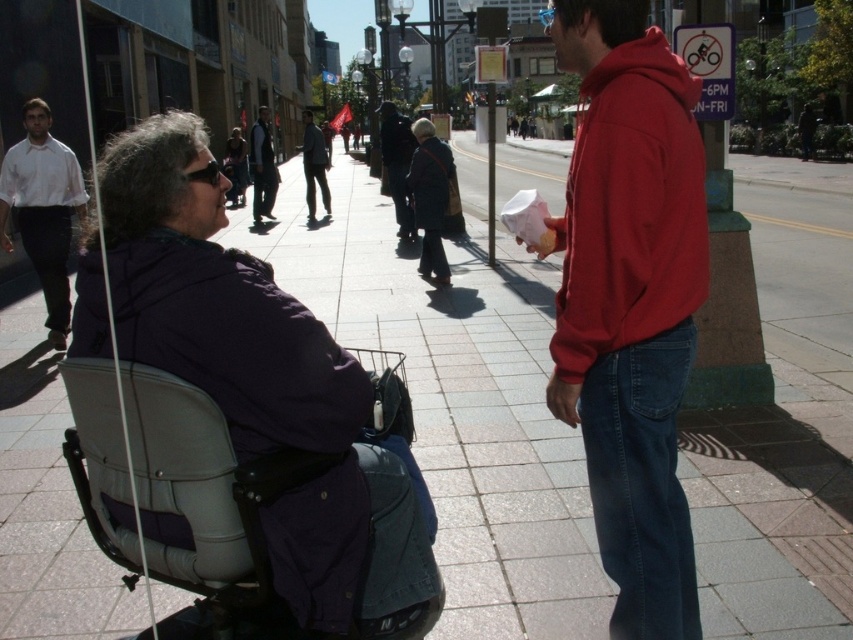
Question: Which of the following is the closest to the observer?

Choices:
 (A) (311, 113)
 (B) (422, 225)
 (C) (77, 173)
 (D) (405, 168)

Answer: (C)

Question: Which point is closer to the camera?

Choices:
 (A) purple soft fabric wheelchair at left
 (B) dark blue jacket at center

Answer: (A)

Question: Which object appears farthest from the camera in this image?

Choices:
 (A) red cotton hoodie at right
 (B) white shirt at left
 (C) dark gray fabric handbag at center
 (D) dark blue jacket at center

Answer: (D)

Question: Does purple soft fabric wheelchair at left have a greater width compared to dark gray fabric handbag at center?

Choices:
 (A) no
 (B) yes

Answer: (B)

Question: Is purple soft fabric wheelchair at left smaller than dark blue jeans at center?

Choices:
 (A) yes
 (B) no

Answer: (A)

Question: Is matte red sweatshirt at right thinner than dark gray suit at center?

Choices:
 (A) no
 (B) yes

Answer: (B)